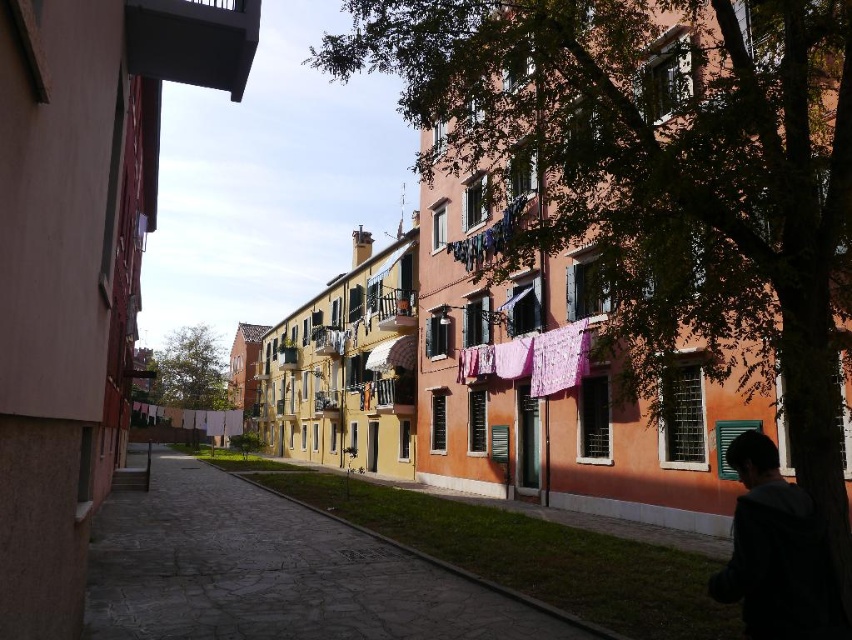
You are standing on the street and want to take a photo of the pink fabric clothesline at upper center. To frame the shot properly, you need to position yourself so that the paved stone alley at center is visible to the left of the clothesline. Based on the scene description, is this possible?

Yes, because the paved stone alley at center is already positioned to the left of the pink fabric clothesline at upper center, so framing the shot as described is possible.

You are standing at the intersection of a cobblestone street and a paved stone alley. The cobblestone street has buildings on both sides, one with warm colors and clotheslines, and the other with a modern beige facade. You see a point labeled as point [281,572]. Based on the scene, where is this point located?

The point [281,572] is located at the paved stone alley at center.

You are standing at the center of the street and want to pick up the dark gray jacket at lower right. Which direction should you move to reach it?

Since the dark gray jacket at lower right is located at coordinate point 0.863 on the x axis and 0.910 on the y axis, you should move to the right and slightly forward to reach it.